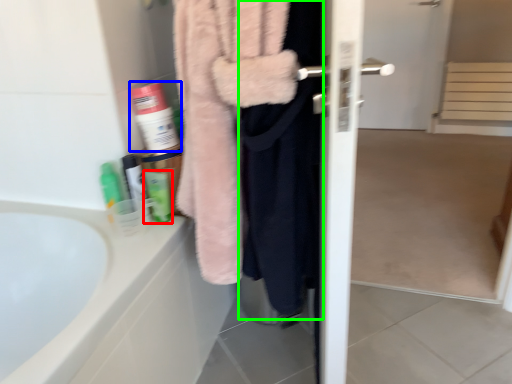
Question: Considering the real-world distances, which object is farthest from toiletry (highlighted by a red box)? cleaning product (highlighted by a blue box) or clothing (highlighted by a green box)?

Choices:
 (A) cleaning product
 (B) clothing

Answer: (B)